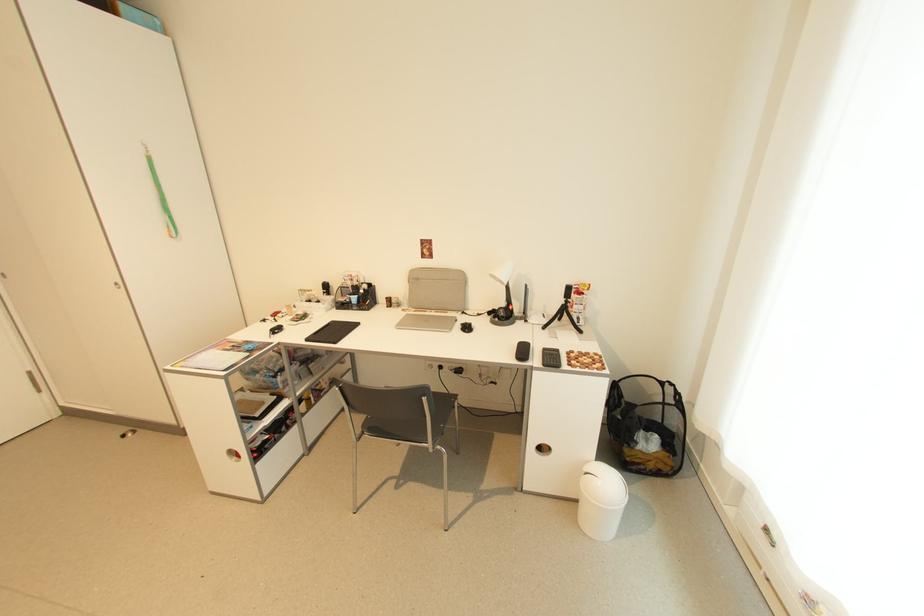
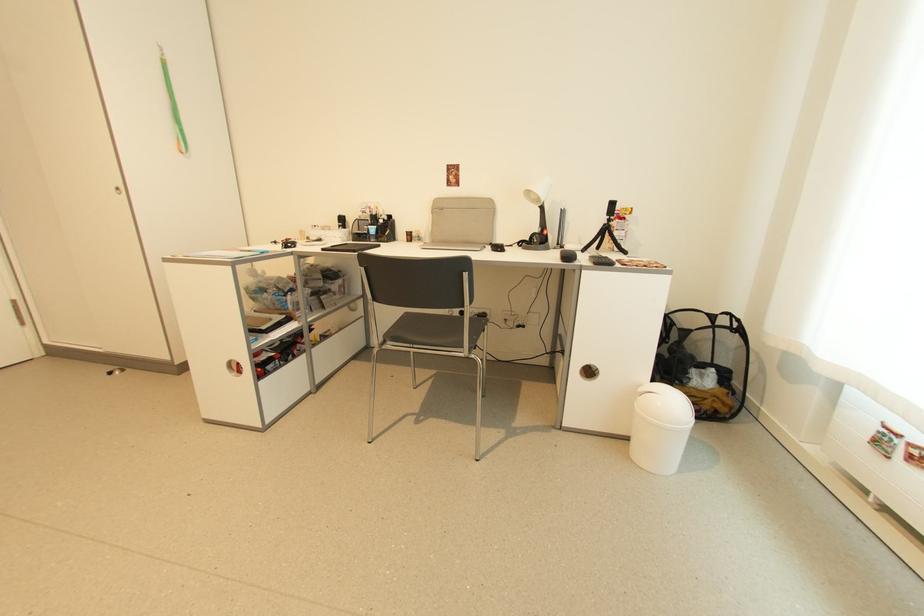
In the second image, find the point that corresponds to (507,306) in the first image.

(541, 232)